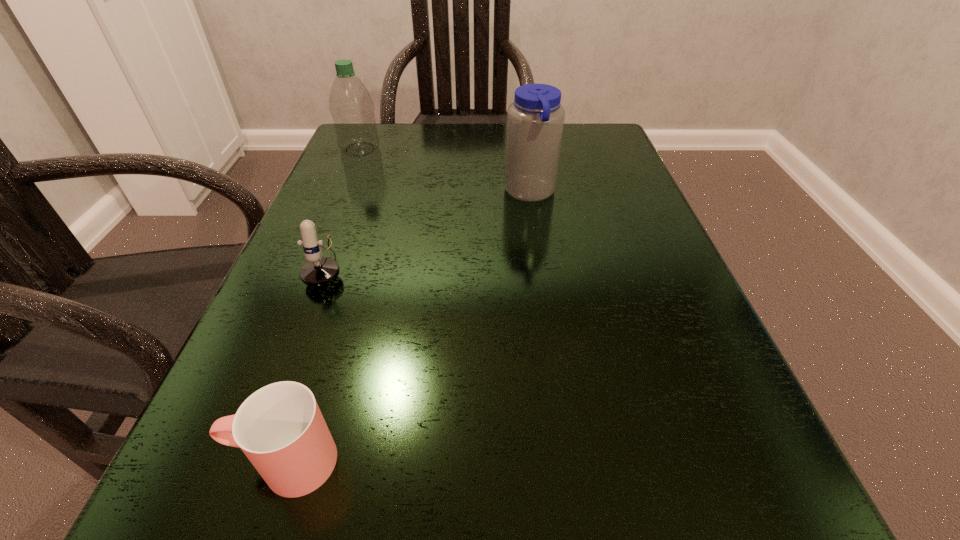
This screenshot has width=960, height=540. I want to click on vacant area at the left edge, so click(x=348, y=240).

The image size is (960, 540). I want to click on vacant space at the right edge, so click(606, 286).

In order to click on free space at the far left corner in this screenshot , I will do `click(389, 145)`.

Where is `vacant space at the far right corner of the desktop`? This screenshot has width=960, height=540. vacant space at the far right corner of the desktop is located at coordinates (566, 154).

Where is `free space that is in between the microphone and the third nearest object`? Image resolution: width=960 pixels, height=540 pixels. free space that is in between the microphone and the third nearest object is located at coordinates (430, 228).

The image size is (960, 540). In order to click on free space between the nearest object and the second nearest object in this screenshot , I will do `click(307, 362)`.

Find the location of a particular element. vacant space in between the left water bottle and the cup is located at coordinates (323, 306).

Where is `free space between the second nearest object and the left water bottle`? This screenshot has height=540, width=960. free space between the second nearest object and the left water bottle is located at coordinates (345, 206).

Image resolution: width=960 pixels, height=540 pixels. What are the coordinates of `vacant region between the nearer water bottle and the left water bottle` in the screenshot? It's located at (445, 171).

Where is `free space between the microphone and the left water bottle`? The height and width of the screenshot is (540, 960). free space between the microphone and the left water bottle is located at coordinates (345, 206).